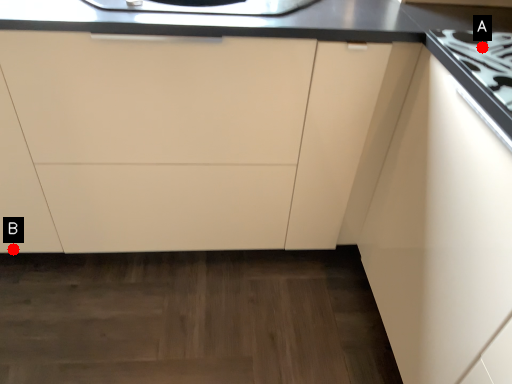
Question: Two points are circled on the image, labeled by A and B beside each circle. Which point is farther to the camera?

Choices:
 (A) A is further
 (B) B is further

Answer: (B)